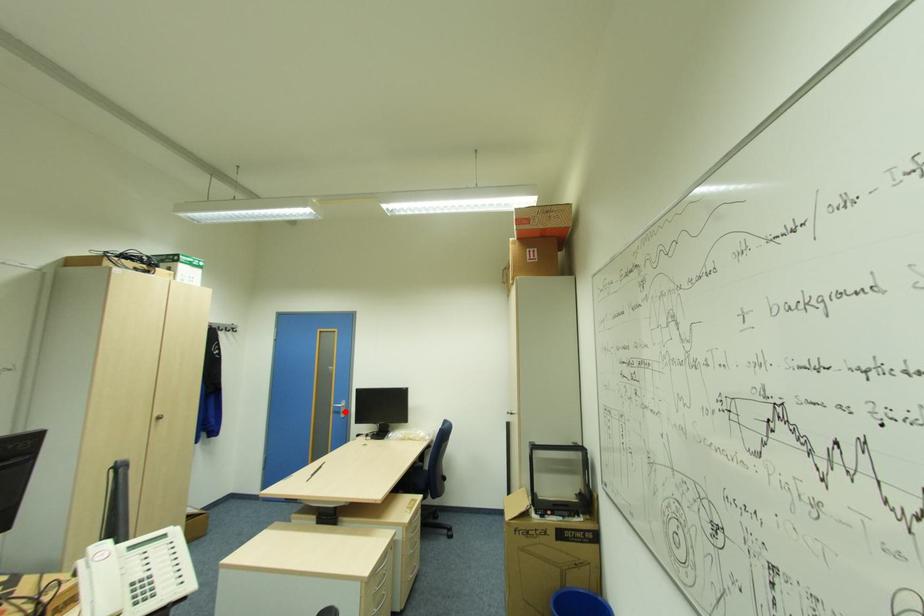
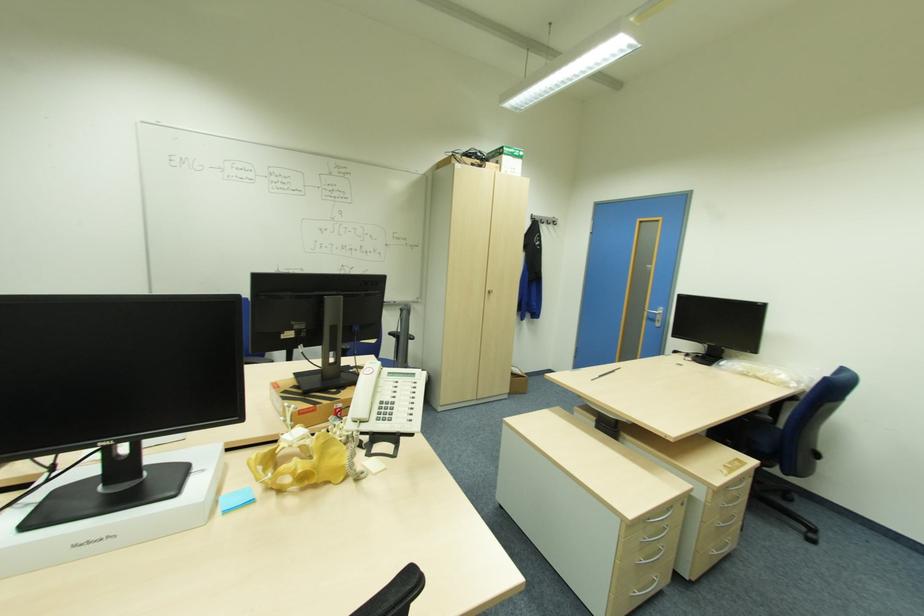
The point at the highlighted location is marked in the first image. Where is the corresponding point in the second image?

(661, 321)